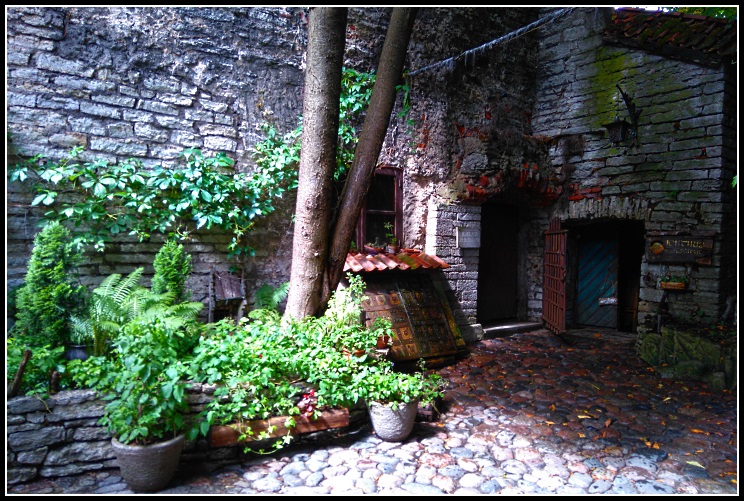
Where is `1 basement set of doors`? 1 basement set of doors is located at coordinates (408, 324).